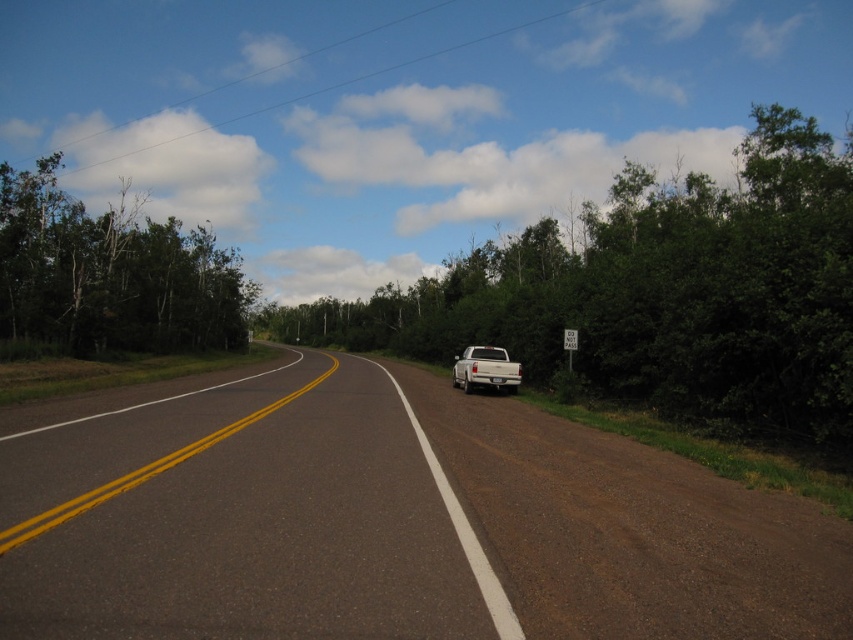
Question: Which point is closer to the camera?

Choices:
 (A) pos(646,396)
 (B) pos(68,353)
 (C) pos(9,486)

Answer: (C)

Question: Among these points, which one is nearest to the camera?

Choices:
 (A) click(x=469, y=358)
 (B) click(x=694, y=342)
 (C) click(x=47, y=500)

Answer: (C)

Question: In this image, where is green leafy tree at right located relative to green leafy trees at left?

Choices:
 (A) below
 (B) above

Answer: (A)

Question: Is green leafy tree at right to the left of green leafy trees at left from the viewer's perspective?

Choices:
 (A) no
 (B) yes

Answer: (A)

Question: Considering the real-world distances, which object is farthest from the green leafy trees at left?

Choices:
 (A) black asphalt road at center
 (B) white matte truck at center-right

Answer: (B)

Question: Does black asphalt road at center have a lesser width compared to white matte truck at center-right?

Choices:
 (A) no
 (B) yes

Answer: (A)